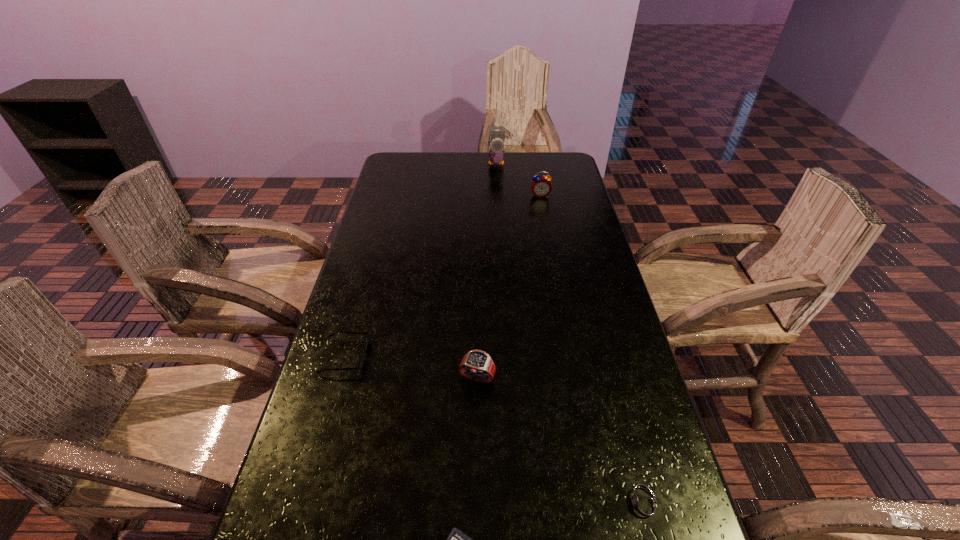
What are the coordinates of `the tallest object` in the screenshot? It's located at (496, 153).

Where is `bird`? bird is located at coordinates (496, 153).

Where is `the second tallest object`? The width and height of the screenshot is (960, 540). the second tallest object is located at coordinates (541, 186).

I want to click on alarm clock, so click(x=541, y=186).

This screenshot has height=540, width=960. Identify the location of the taller watch. (477, 365).

Find the location of a particular element. This screenshot has width=960, height=540. the third tallest object is located at coordinates (477, 365).

Identify the location of the fourth tallest object. The image size is (960, 540). (361, 361).

You are a GUI agent. You are given a task and a screenshot of the screen. Output one action in this format:
    pyautogui.click(x=<x>, y=<y>)
    Task: Click on the leftmost object
    The width and height of the screenshot is (960, 540).
    Given the screenshot: What is the action you would take?
    pyautogui.click(x=361, y=361)

Locate an element on the screen. the right watch is located at coordinates (642, 504).

You are a GUI agent. You are given a task and a screenshot of the screen. Output one action in this format:
    pyautogui.click(x=<x>, y=<y>)
    Task: Click on the shorter watch
    
    Given the screenshot: What is the action you would take?
    pyautogui.click(x=642, y=504)